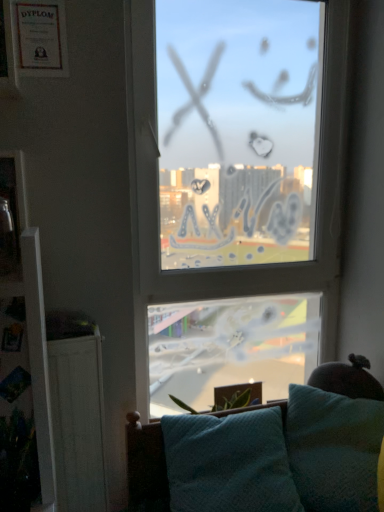
Question: Considering the positions of transparent glass window at center and teal fabric studio couch at lower center in the image, is transparent glass window at center bigger or smaller than teal fabric studio couch at lower center?

Choices:
 (A) small
 (B) big

Answer: (A)

Question: In terms of height, does transparent glass window at center look taller or shorter compared to teal fabric studio couch at lower center?

Choices:
 (A) tall
 (B) short

Answer: (A)

Question: Which object is positioned farthest from the matte paper frame at upper left, placed as the 2th picture frame when sorted from front to back?

Choices:
 (A) transparent glass window at center
 (B) metallic glass picture frame at left, which appears as the second picture frame when viewed from the top
 (C) teal fabric pillow at lower right
 (D) teal fabric studio couch at lower center

Answer: (C)

Question: Estimate the real-world distances between objects in this image. Which object is farther from the teal fabric pillow at lower right?

Choices:
 (A) transparent glass window at center
 (B) metallic glass picture frame at left, which is counted as the 1th picture frame, starting from the bottom
 (C) matte paper frame at upper left, placed as the 2th picture frame when sorted from front to back
 (D) teal fabric studio couch at lower center

Answer: (C)